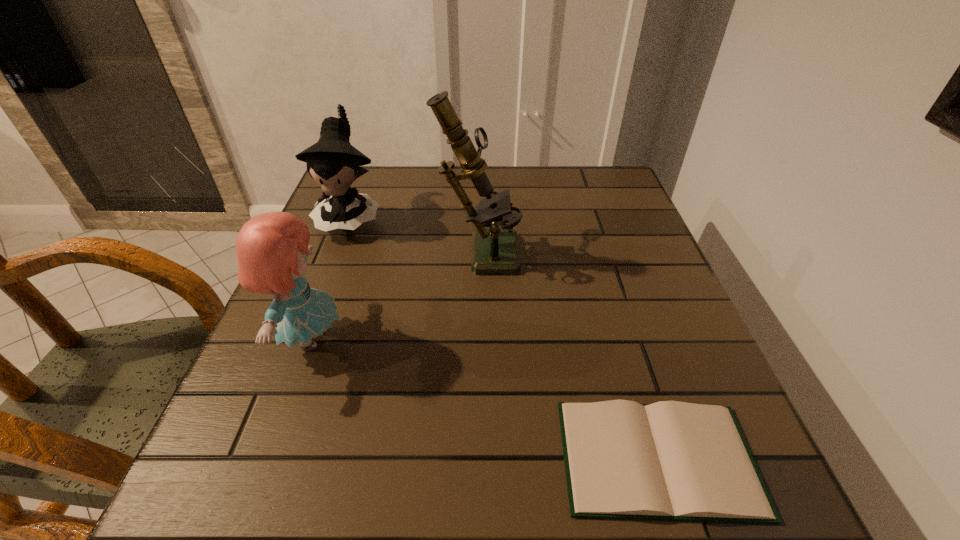
This screenshot has height=540, width=960. I want to click on free spot between the farther doll and the microscope, so click(x=415, y=233).

Find the location of `the second closest object relative to the rightmost object`. the second closest object relative to the rightmost object is located at coordinates (272, 248).

Point out which object is positioned as the third nearest to the microscope. Please provide its 2D coordinates. Your answer should be formatted as a tuple, i.e. [(x, y)], where the tuple contains the x and y coordinates of a point satisfying the conditions above.

[(676, 461)]

Image resolution: width=960 pixels, height=540 pixels. Identify the location of free point that satisfies the following two spatial constraints: 1. at the eyepiece of the hardback book; 2. on the right side of the third object from left to right. (477, 458).

Find the location of a particular element. Image resolution: width=960 pixels, height=540 pixels. vacant point that satisfies the following two spatial constraints: 1. on the front-facing side of the second nearest object; 2. on the left side of the shortest object is located at coordinates (266, 458).

Find the location of a particular element. This screenshot has height=540, width=960. free space that satisfies the following two spatial constraints: 1. on the back side of the nearest object; 2. on the front-facing side of the nearer doll is located at coordinates (621, 339).

Locate an element on the screen. blank area in the image that satisfies the following two spatial constraints: 1. at the eyepiece of the rightmost object; 2. on the right side of the microscope is located at coordinates (477, 458).

At what (x,y) coordinates should I click in order to perform the action: click on free space that satisfies the following two spatial constraints: 1. on the front-facing side of the third farthest object; 2. on the left side of the nearest object. Please return your answer as a coordinate pair (x, y). Looking at the image, I should click on (266, 458).

The height and width of the screenshot is (540, 960). Identify the location of free space in the image that satisfies the following two spatial constraints: 1. at the face of the rightmost object; 2. on the left side of the farther doll. point(258,458).

Identify the location of free region that satisfies the following two spatial constraints: 1. at the face of the nearest object; 2. on the right side of the farther doll. This screenshot has height=540, width=960. (258, 458).